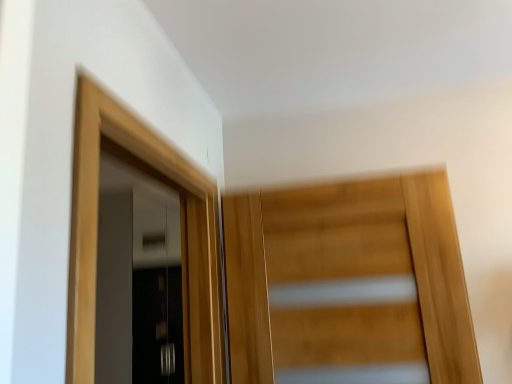
Question: Considering the positions of wooden door at center, the 2th door from the back, and matte black door at left, which is the third door from front to back, in the image, is wooden door at center, the 2th door from the back, wider or thinner than matte black door at left, which is the third door from front to back,?

Choices:
 (A) wide
 (B) thin

Answer: (B)

Question: Is wooden door at center, the 2th door from the back, inside or outside of matte black door at left, which ranks as the first door in back-to-front order?

Choices:
 (A) inside
 (B) outside

Answer: (B)

Question: Estimate the real-world distances between objects in this image. Which object is farther from the light wood door at upper left, which is the 2th door from left to right?

Choices:
 (A) matte black door at left, marked as the 3th door in a right-to-left arrangement
 (B) wooden door at center, the 3th door viewed from the left

Answer: (A)

Question: Estimate the real-world distances between objects in this image. Which object is farther from the matte black door at left, which ranks as the first door in back-to-front order?

Choices:
 (A) light wood door at upper left, which appears as the 3th door when viewed from the back
 (B) wooden door at center, the 3th door viewed from the left

Answer: (A)